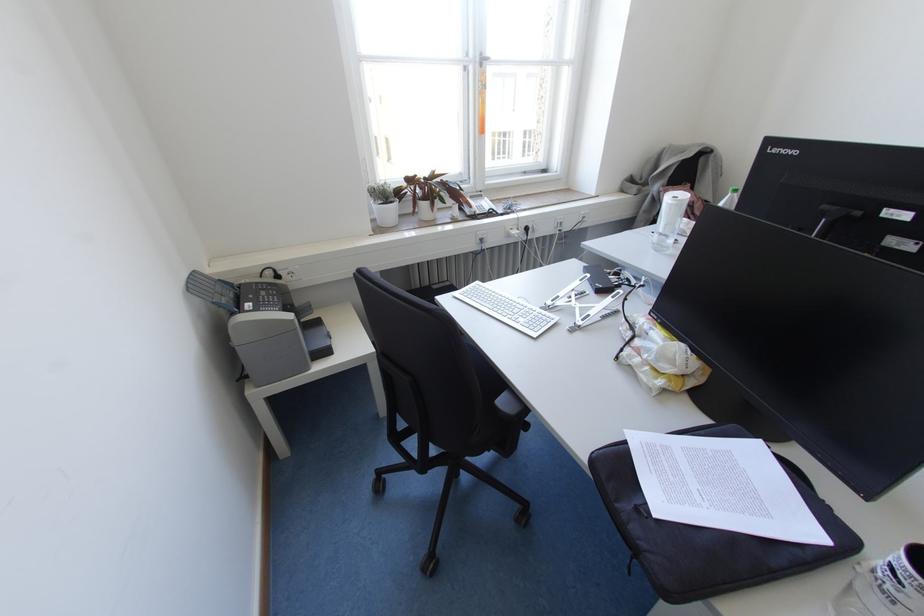
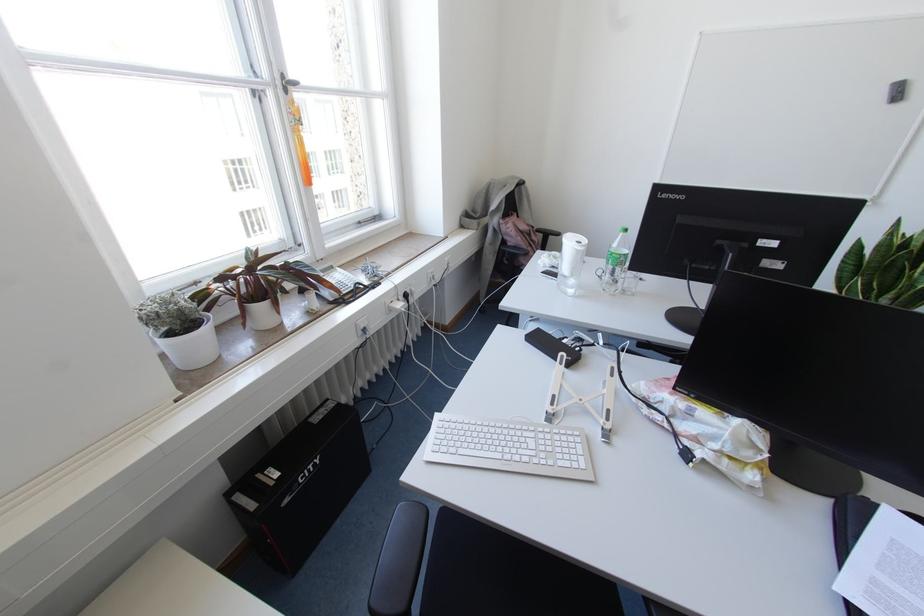
Question: The first image is from the beginning of the video and the second image is from the end. How did the camera likely rotate when shooting the video?

Choices:
 (A) Left
 (B) Right
 (C) Up
 (D) Down

Answer: (B)